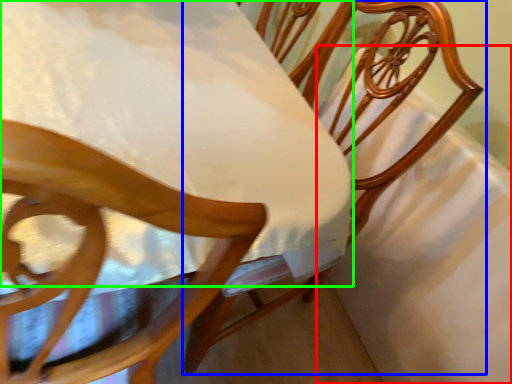
Question: Which object is the farthest from sheet (highlighted by a red box)? Choose among these: chair (highlighted by a blue box) or table (highlighted by a green box).

Choices:
 (A) chair
 (B) table

Answer: (B)